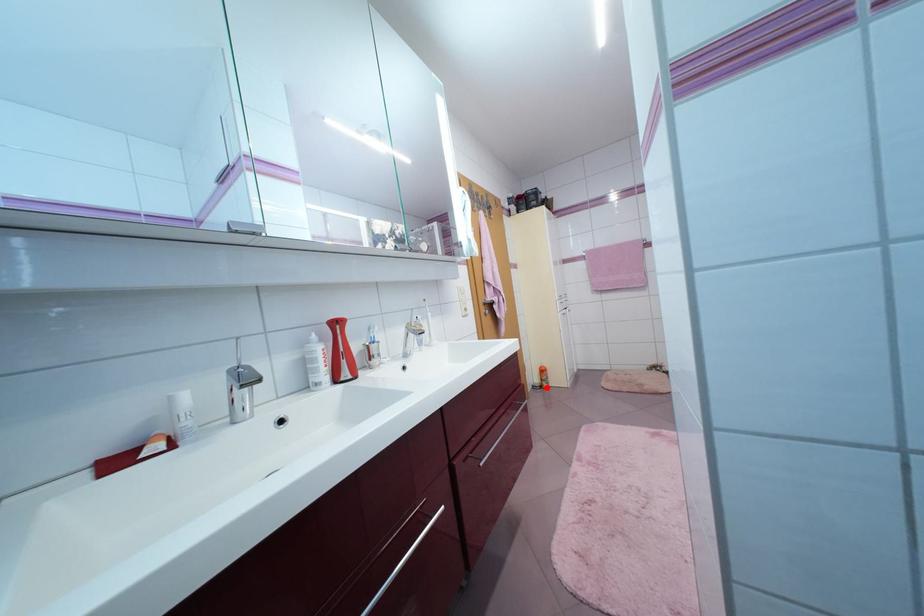
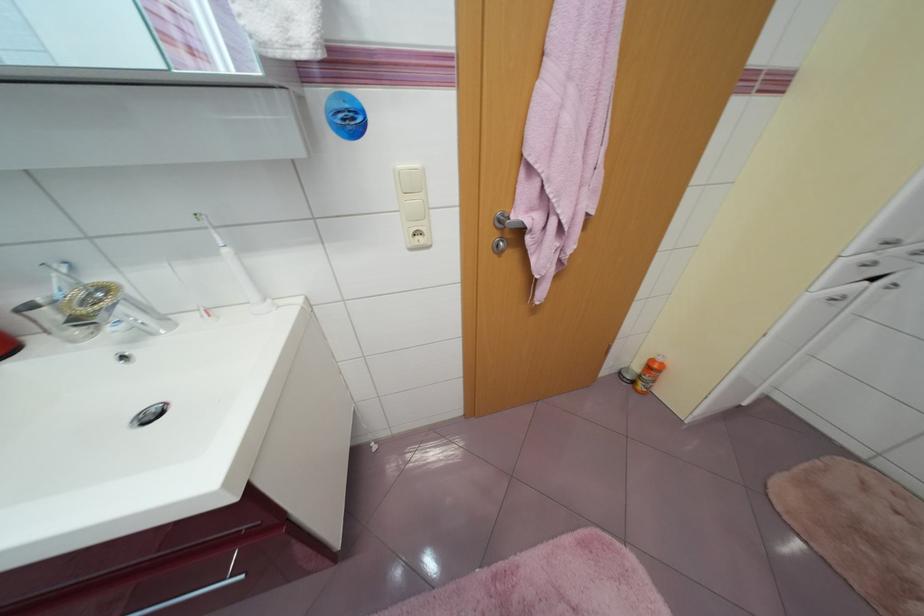
In the second image, find the point that corresponds to the highlighted location in the first image.

(638, 383)